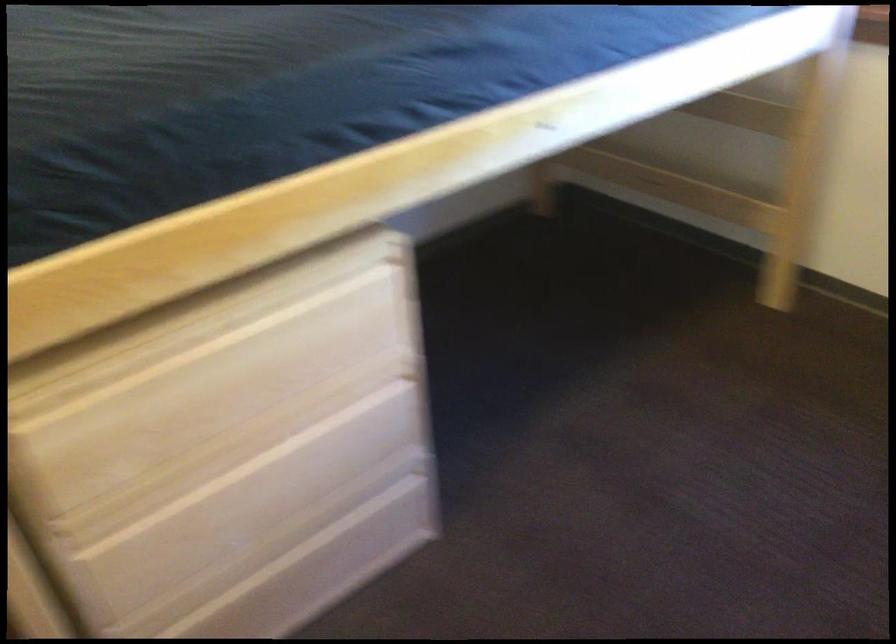
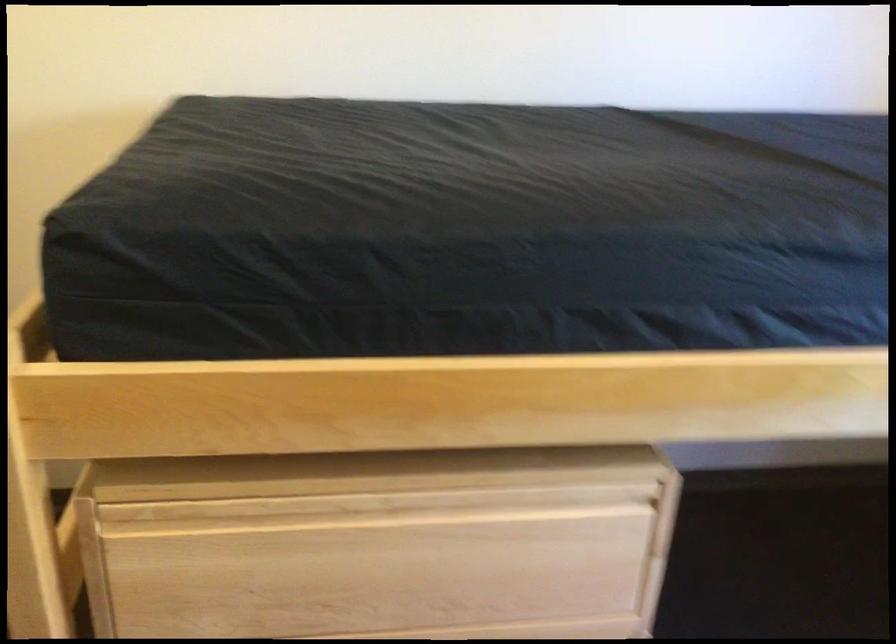
Question: How did the camera likely rotate?

Choices:
 (A) Left
 (B) Right
 (C) Up
 (D) Down

Answer: (A)